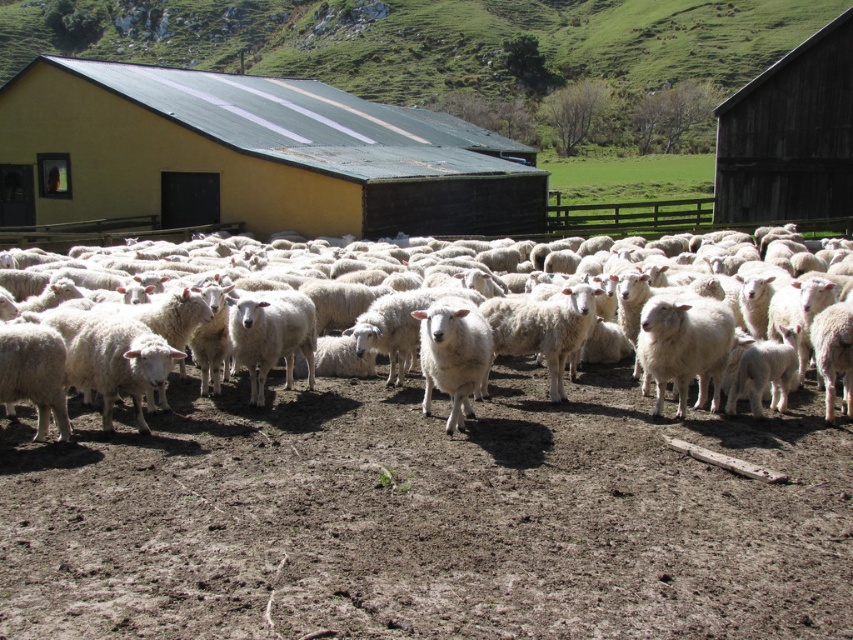
Question: Which point appears closest to the camera in this image?

Choices:
 (A) (486, 193)
 (B) (581, 320)
 (C) (798, 67)

Answer: (B)

Question: Which point appears farthest from the camera in this image?

Choices:
 (A) (323, 93)
 (B) (822, 209)
 (C) (688, 312)

Answer: (A)

Question: Can you confirm if yellow matte barn at center is wider than white woolly sheep at center?

Choices:
 (A) yes
 (B) no

Answer: (A)

Question: Which point is closer to the camera taking this photo?

Choices:
 (A) (206, 164)
 (B) (770, 180)

Answer: (A)

Question: Can you confirm if yellow matte barn at center is thinner than dark brown wooden barn at upper right?

Choices:
 (A) no
 (B) yes

Answer: (A)

Question: Does yellow matte barn at center have a larger size compared to white woolly sheep at center?

Choices:
 (A) yes
 (B) no

Answer: (A)